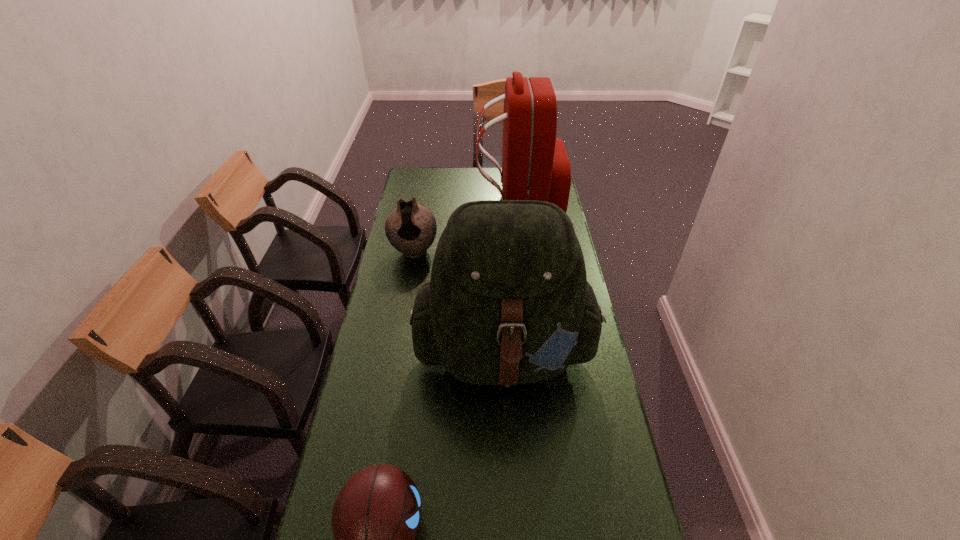
The width and height of the screenshot is (960, 540). I want to click on the farthest object, so click(x=535, y=166).

Where is `the third farthest object`? The width and height of the screenshot is (960, 540). the third farthest object is located at coordinates (508, 302).

You are a GUI agent. You are given a task and a screenshot of the screen. Output one action in this format:
    pyautogui.click(x=<x>, y=<y>)
    Task: Click on the pottery
    This screenshot has width=960, height=540.
    Given the screenshot: What is the action you would take?
    pyautogui.click(x=411, y=229)

Image resolution: width=960 pixels, height=540 pixels. I want to click on the third nearest object, so click(x=411, y=229).

Find the location of a particular element. The height and width of the screenshot is (540, 960). vacant space located 0.290m on the strap side of the farther backpack is located at coordinates (415, 202).

Locate an element on the screen. This screenshot has height=540, width=960. free region located on the strap side of the farther backpack is located at coordinates (413, 202).

Where is `vacant area situated 0.170m on the strap side of the farther backpack`? This screenshot has height=540, width=960. vacant area situated 0.170m on the strap side of the farther backpack is located at coordinates (441, 202).

Where is `blank area located on the open flap of the nearer backpack`? blank area located on the open flap of the nearer backpack is located at coordinates (515, 528).

Identify the location of vacant region located from the spout of the third tallest object. The height and width of the screenshot is (540, 960). (397, 346).

Image resolution: width=960 pixels, height=540 pixels. I want to click on object that is positioned at the far edge, so pyautogui.click(x=535, y=166).